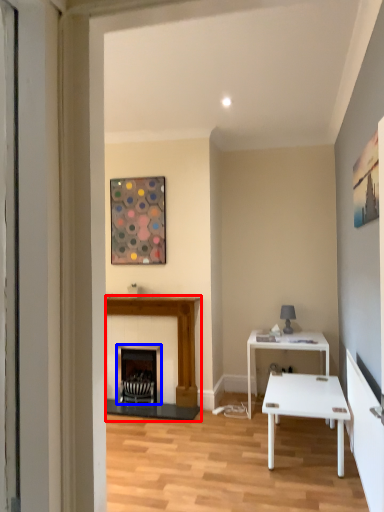
Question: Which of the following is the farthest to the observer, fireplace (highlighted by a red box) or fireplace (highlighted by a blue box)?

Choices:
 (A) fireplace
 (B) fireplace

Answer: (B)